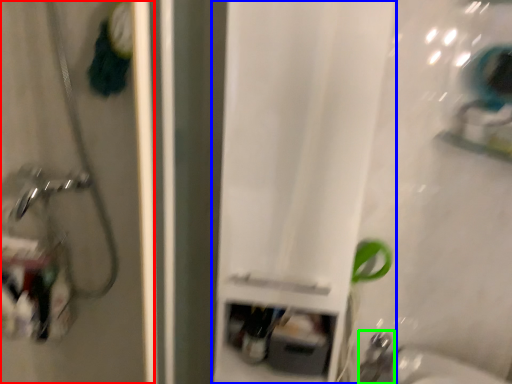
Question: Estimate the real-world distances between objects in this image. Which object is closer to screen door (highlighted by a red box), curtain (highlighted by a blue box) or faucet (highlighted by a green box)?

Choices:
 (A) curtain
 (B) faucet

Answer: (A)